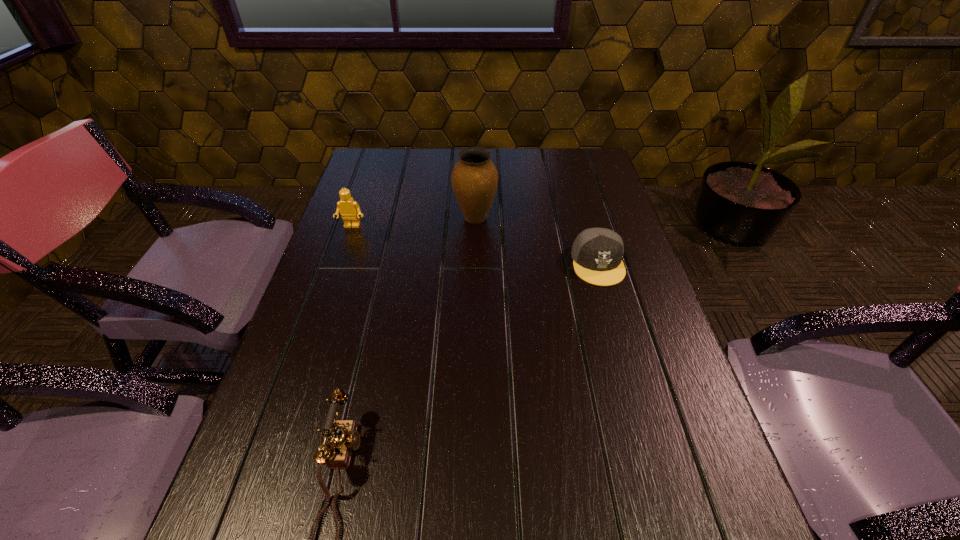
Image resolution: width=960 pixels, height=540 pixels. Identify the location of free spot between the urn and the Lego. (414, 222).

In order to click on vacant region between the shortest object and the tallest object in this screenshot , I will do pos(537,241).

Locate an element on the screen. object that can be found as the closest to the shortest object is located at coordinates tap(474, 179).

At what (x,y) coordinates should I click in order to perform the action: click on object that stands as the closest to the leftmost object. Please return your answer as a coordinate pair (x, y). This screenshot has width=960, height=540. Looking at the image, I should click on click(474, 179).